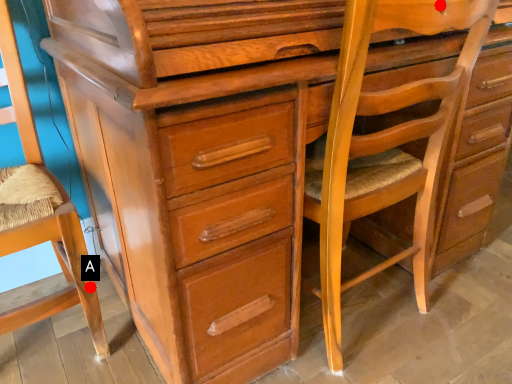
Question: Two points are circled on the image, labeled by A and B beside each circle. Which point is farther to the camera?

Choices:
 (A) A is further
 (B) B is further

Answer: (A)